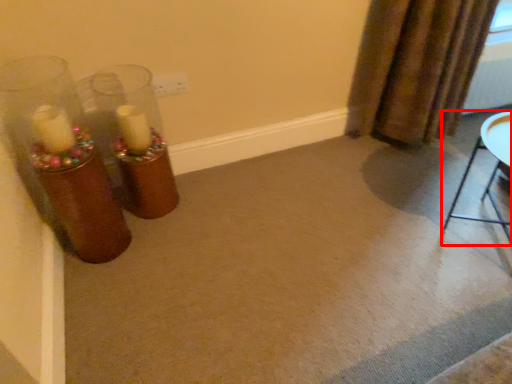
Question: From the image's perspective, what is the correct spatial relationship of furniture (annotated by the red box) in relation to curtain?

Choices:
 (A) below
 (B) above

Answer: (A)